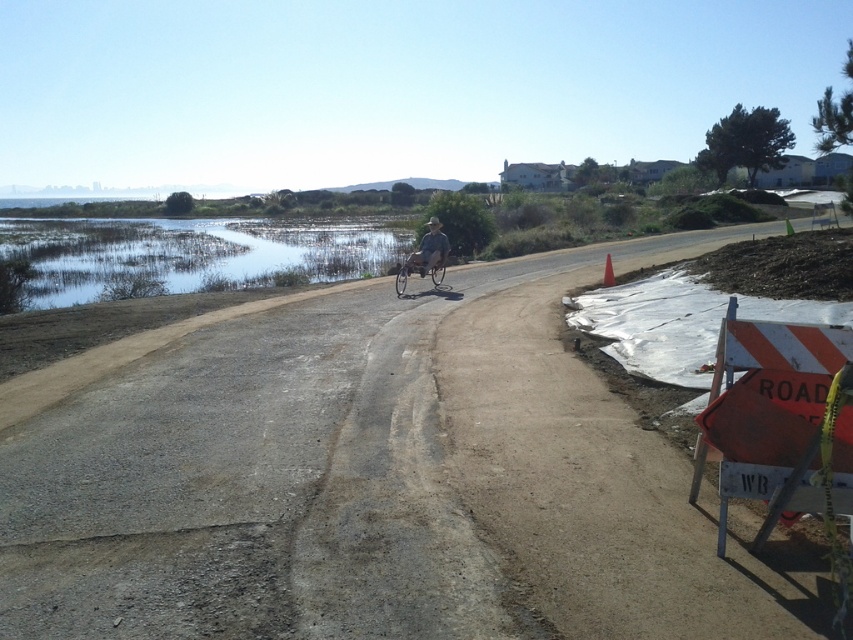
You are a delivery person trying to navigate through the construction zone on the dirt road. You see a camouflage fabric shirt at center and a silver metallic bicycle at center. Which object takes up more space horizontally?

The silver metallic bicycle at center has a greater width than the camouflage fabric shirt at center, so it takes up more horizontal space.

You are a delivery driver who needs to deliver a package to a person wearing a camouflage fabric shirt at center. The shirt is located at point 0.391 on the x axis and 0.504 on the y axis. The road is 10 meters wide. Can you safely drive your truck along the road to reach the person?

The camouflage fabric shirt at center is located at coordinates 0.391 on the x axis and 0.504 on the y axis. Since the road is 10 meters wide, the truck can safely navigate the road to reach the person.

You are a hiker who wants to cross the road safely. You see the clear water at center and the camouflage fabric shirt at center. Which object is closer to the road surface?

The camouflage fabric shirt at center is closer to the road surface because the clear water at center is located above it.